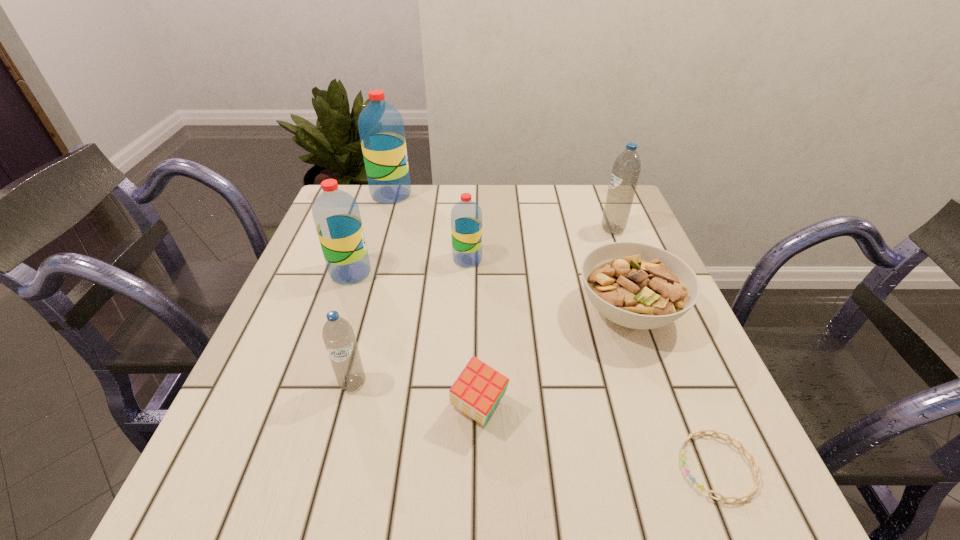
Locate an element on the screen. This screenshot has width=960, height=540. vacant area that lies between the bracelet and the red cube is located at coordinates (598, 437).

Where is `free space between the blue bracelet and the second smallest red water bottle`? free space between the blue bracelet and the second smallest red water bottle is located at coordinates (535, 370).

Find the location of `vacant space that is in between the red cube and the nearest water bottle`. vacant space that is in between the red cube and the nearest water bottle is located at coordinates (416, 396).

This screenshot has height=540, width=960. Identify the location of vacant area that lies between the smaller blue water bottle and the red cube. (416, 396).

Where is `vacant region between the rightmost water bottle and the shortest object`? The height and width of the screenshot is (540, 960). vacant region between the rightmost water bottle and the shortest object is located at coordinates (665, 348).

Where is `free spot between the biggest red water bottle and the bigger blue water bottle`? The width and height of the screenshot is (960, 540). free spot between the biggest red water bottle and the bigger blue water bottle is located at coordinates (502, 212).

I want to click on the closest object relative to the farthest red water bottle, so click(x=336, y=214).

Image resolution: width=960 pixels, height=540 pixels. Identify the location of the fifth closest object to the bracelet. (626, 169).

Image resolution: width=960 pixels, height=540 pixels. Find the location of `water bottle that is the fourth closest to the left blue water bottle`. water bottle that is the fourth closest to the left blue water bottle is located at coordinates (626, 169).

You are a GUI agent. You are given a task and a screenshot of the screen. Output one action in this format:
    pyautogui.click(x=<x>, y=<y>)
    Task: Click on the water bottle that stands as the third closest to the red cube
    
    Given the screenshot: What is the action you would take?
    pyautogui.click(x=336, y=214)